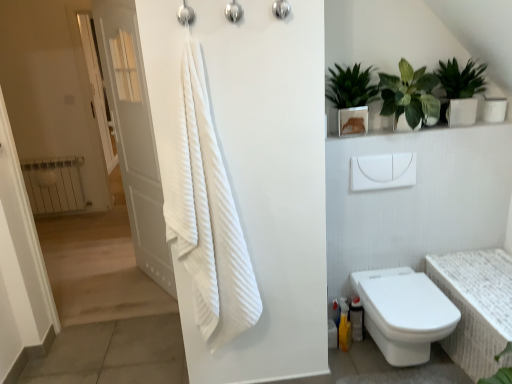
Question: Could you tell me if white textured bath at lower right is facing green glossy plant at upper right, arranged as the 3th houseplant when viewed from the right?

Choices:
 (A) no
 (B) yes

Answer: (A)

Question: Is white textured bath at lower right bigger than green glossy plant at upper right, which appears as the 1th houseplant when viewed from the left?

Choices:
 (A) no
 (B) yes

Answer: (B)

Question: Is the position of white textured bath at lower right more distant than that of green glossy plant at upper right, arranged as the 3th houseplant when viewed from the right?

Choices:
 (A) no
 (B) yes

Answer: (A)

Question: Are white textured bath at lower right and green glossy plant at upper right, which appears as the 1th houseplant when viewed from the left, beside each other?

Choices:
 (A) no
 (B) yes

Answer: (A)

Question: Is white textured bath at lower right positioned beyond the bounds of green glossy plant at upper right, which appears as the 1th houseplant when viewed from the left?

Choices:
 (A) yes
 (B) no

Answer: (A)

Question: Can you confirm if white textured bath at lower right is taller than green glossy plant at upper right, arranged as the 3th houseplant when viewed from the right?

Choices:
 (A) yes
 (B) no

Answer: (A)

Question: Would you consider white wood door at left to be distant from green glossy plant at upper right, acting as the 1th houseplant starting from the right?

Choices:
 (A) no
 (B) yes

Answer: (B)

Question: Considering the relative positions of white wood door at left and green glossy plant at upper right, the 3th houseplant from the left, in the image provided, is white wood door at left behind green glossy plant at upper right, the 3th houseplant from the left,?

Choices:
 (A) yes
 (B) no

Answer: (A)

Question: Is white wood door at left next to green glossy plant at upper right, the 3th houseplant from the left, and touching it?

Choices:
 (A) no
 (B) yes

Answer: (A)

Question: Does white wood door at left have a lesser width compared to green glossy plant at upper right, acting as the 1th houseplant starting from the right?

Choices:
 (A) no
 (B) yes

Answer: (B)

Question: Is white wood door at left at the right side of green glossy plant at upper right, the 3th houseplant from the left?

Choices:
 (A) yes
 (B) no

Answer: (B)

Question: Is white wood door at left wider than green glossy plant at upper right, the 3th houseplant from the left?

Choices:
 (A) yes
 (B) no

Answer: (B)

Question: From the image's perspective, is green glossy plant at upper right, acting as the 1th houseplant starting from the right, below green leafy plant at upper right, arranged as the 2th houseplant when viewed from the left?

Choices:
 (A) yes
 (B) no

Answer: (B)